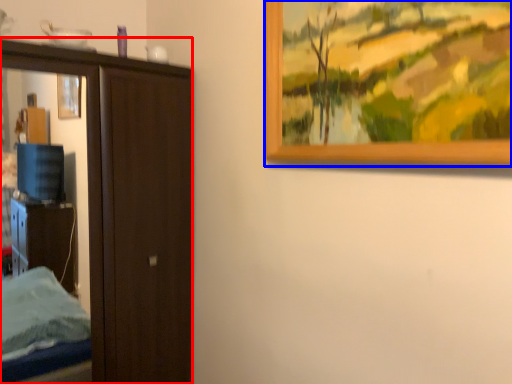
Question: Which object appears farthest to the camera in this image, door (highlighted by a red box) or picture frame (highlighted by a blue box)?

Choices:
 (A) door
 (B) picture frame

Answer: (A)